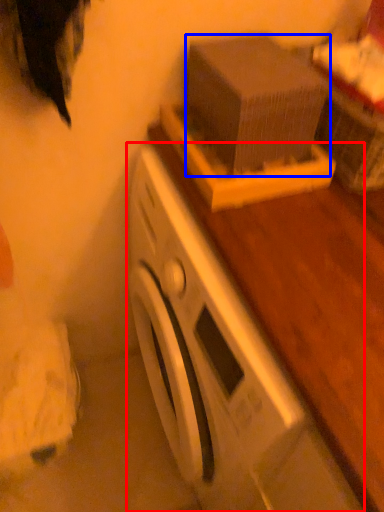
Question: Among these objects, which one is nearest to the camera, washing machine (highlighted by a red box) or box (highlighted by a blue box)?

Choices:
 (A) washing machine
 (B) box

Answer: (A)